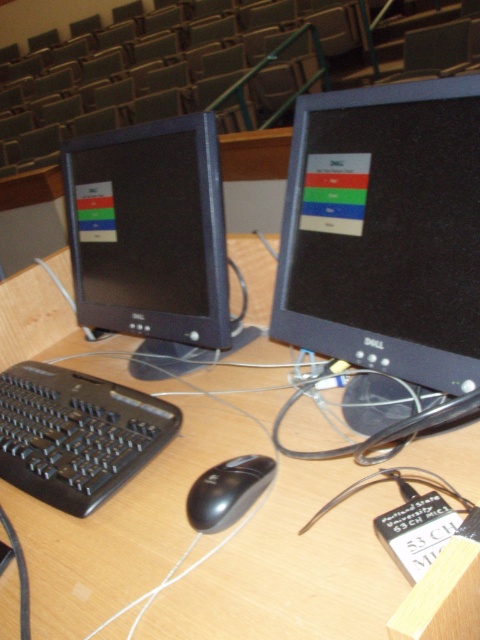
Question: Which object is farther from the camera taking this photo?

Choices:
 (A) black matte mouse at center
 (B) matte black monitor at left
 (C) black plastic keyboard at lower left

Answer: (B)

Question: From the image, what is the correct spatial relationship of matte black monitor at left in relation to black plastic keyboard at lower left?

Choices:
 (A) left
 (B) right

Answer: (B)

Question: Which object is the closest to the black plastic keyboard at lower left?

Choices:
 (A) matte black monitor at left
 (B) black matte mouse at center

Answer: (A)

Question: Which point is closer to the camera?

Choices:
 (A) click(80, 154)
 (B) click(57, 499)

Answer: (B)

Question: Does matte black monitor at center have a smaller size compared to matte black monitor at left?

Choices:
 (A) no
 (B) yes

Answer: (B)

Question: Does matte black monitor at left come behind black plastic keyboard at lower left?

Choices:
 (A) yes
 (B) no

Answer: (A)